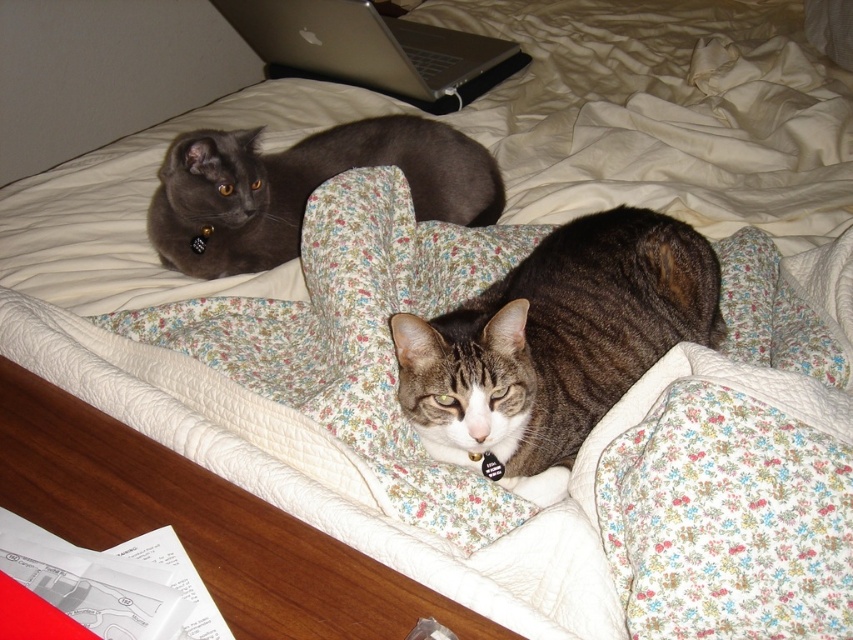
Question: Can you confirm if tabby fur cat at center is thinner than silver metallic laptop at upper center?

Choices:
 (A) no
 (B) yes

Answer: (B)

Question: Is matte gray cat at upper left below silver metallic laptop at upper center?

Choices:
 (A) yes
 (B) no

Answer: (A)

Question: Which object is farther from the camera taking this photo?

Choices:
 (A) tabby fur cat at center
 (B) matte gray cat at upper left

Answer: (B)

Question: Which object is the closest to the tabby fur cat at center?

Choices:
 (A) matte gray cat at upper left
 (B) silver metallic laptop at upper center

Answer: (A)

Question: Is the position of tabby fur cat at center more distant than that of silver metallic laptop at upper center?

Choices:
 (A) yes
 (B) no

Answer: (B)

Question: Which point is farther from the camera taking this photo?

Choices:
 (A) (544, 305)
 (B) (508, 52)

Answer: (B)